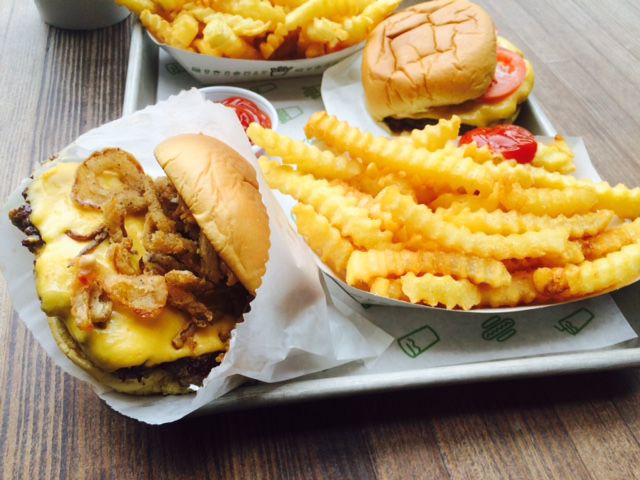
Find the location of `serving tray`. serving tray is located at coordinates (139, 89).